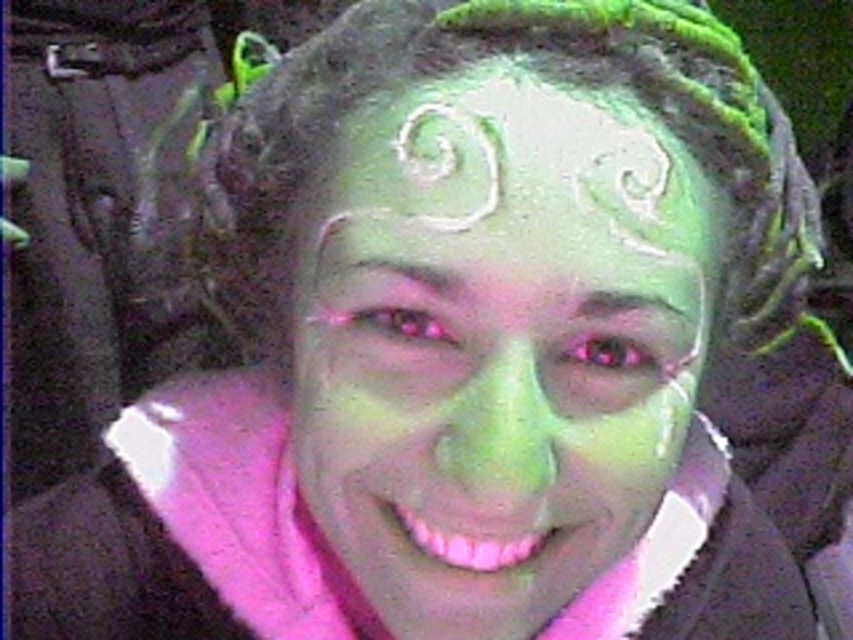
Question: Which object appears farthest from the camera in this image?

Choices:
 (A) green matte face paint at center
 (B) white matte forehead at center

Answer: (B)

Question: Does green matte face paint at center appear on the left side of white matte forehead at center?

Choices:
 (A) yes
 (B) no

Answer: (B)

Question: Is green matte face paint at center wider than white matte forehead at center?

Choices:
 (A) no
 (B) yes

Answer: (B)

Question: Does green matte face paint at center appear over white matte forehead at center?

Choices:
 (A) no
 (B) yes

Answer: (A)

Question: Which object appears closest to the camera in this image?

Choices:
 (A) green matte face paint at center
 (B) white matte forehead at center

Answer: (A)